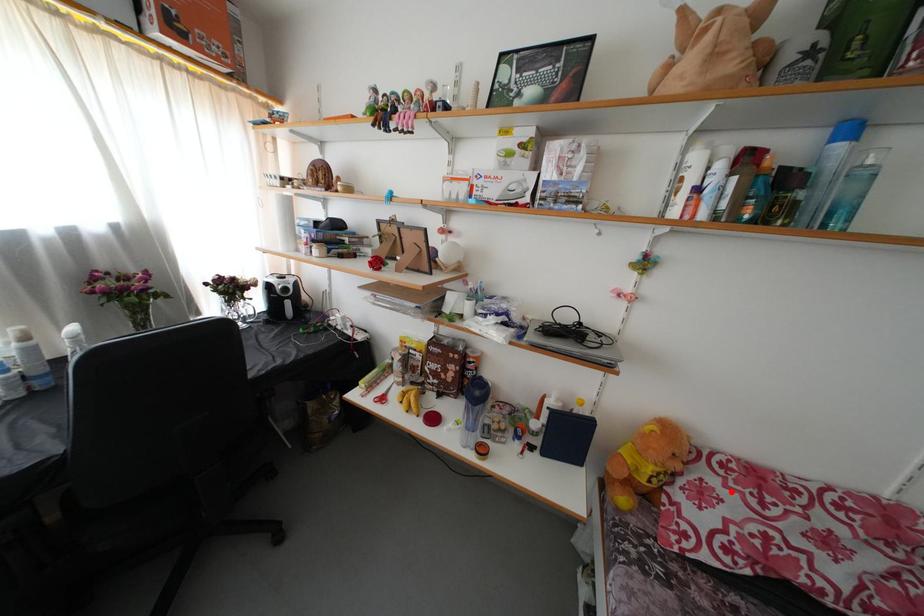
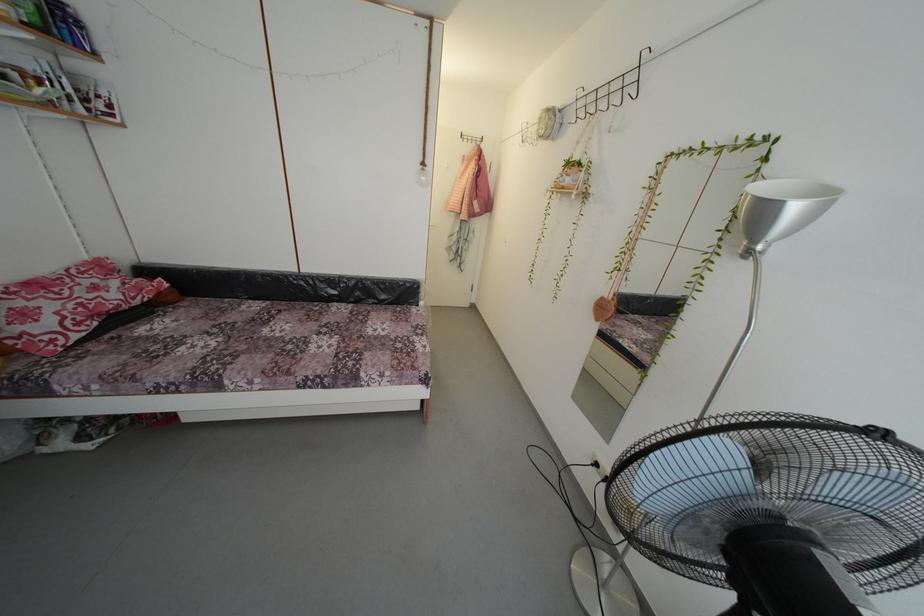
Question: I am providing you with two images of the same scene from different viewpoints. A red point is marked on the first image. Is the red point's position out of view in image 2?

Choices:
 (A) Yes
 (B) No

Answer: (B)